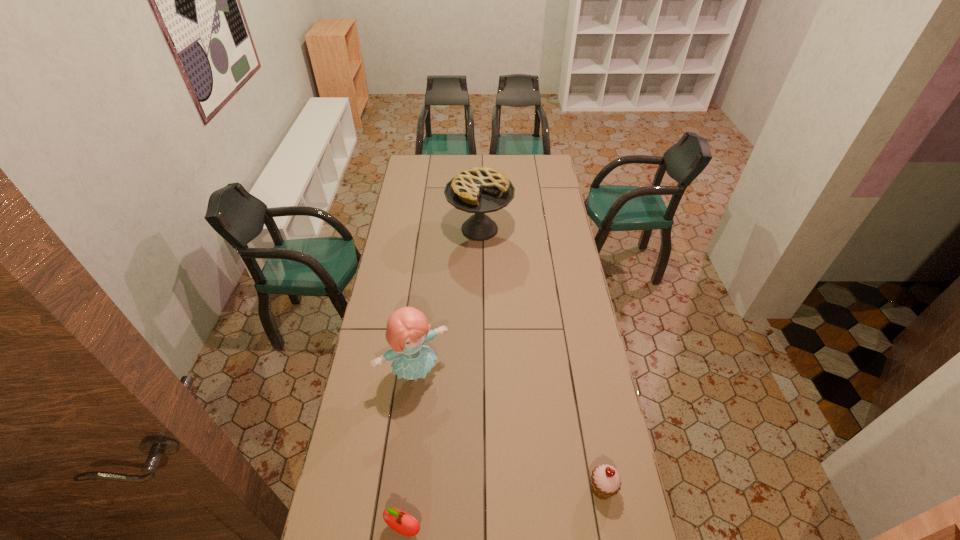
The height and width of the screenshot is (540, 960). In order to click on vacant spot on the desktop that is between the apple and the rightmost object and is positioned on the cut side of the pie in this screenshot , I will do `click(516, 506)`.

Where is `vacant space on the desktop that is between the nearest object and the cupcake and is positioned on the front-facing side of the third nearest object`? This screenshot has width=960, height=540. vacant space on the desktop that is between the nearest object and the cupcake and is positioned on the front-facing side of the third nearest object is located at coordinates (503, 509).